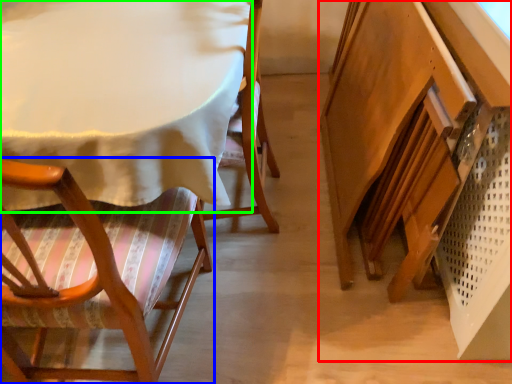
Question: Considering the real-world distances, which object is farthest from vanity (highlighted by a red box)? chair (highlighted by a blue box) or table (highlighted by a green box)?

Choices:
 (A) chair
 (B) table

Answer: (A)